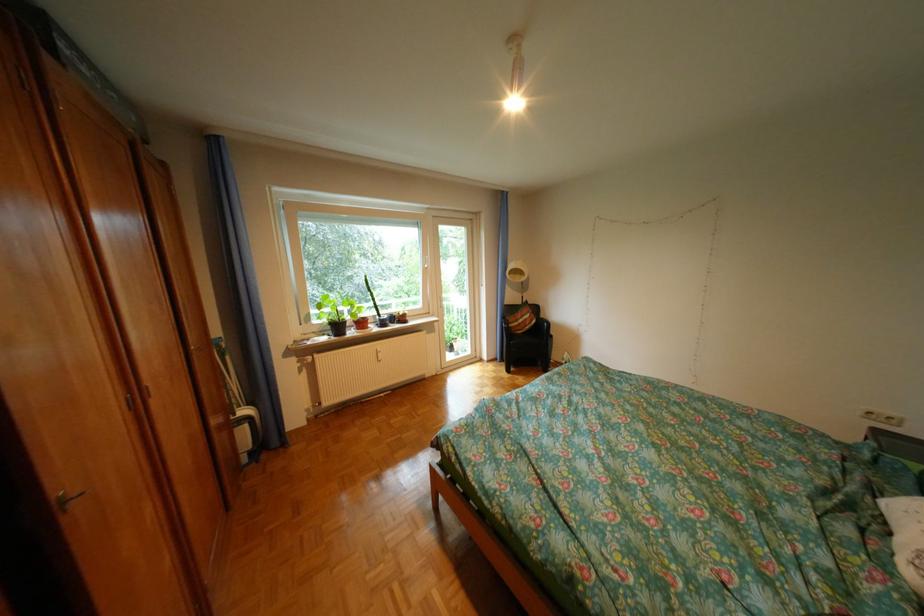
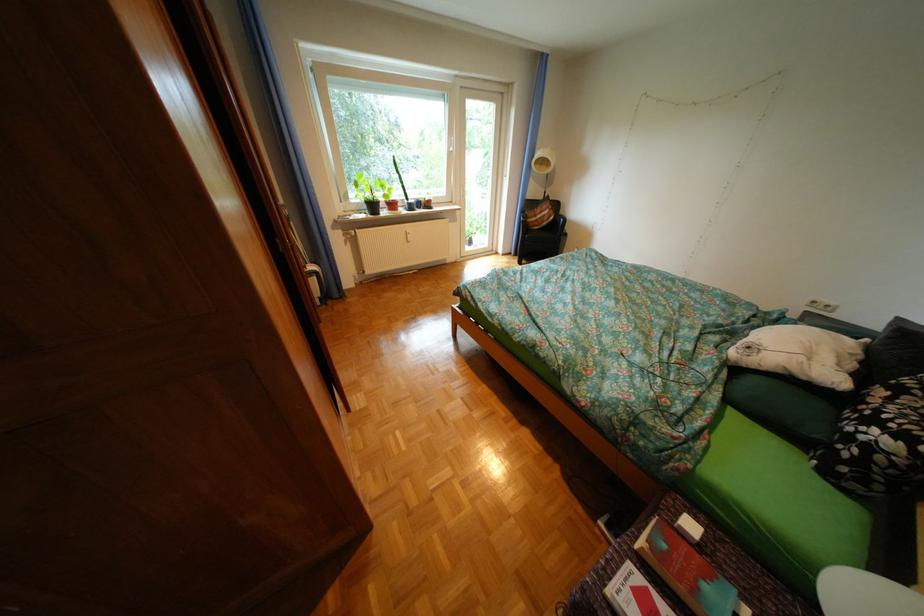
Locate, in the second image, the point that corresponds to the point at 353,328 in the first image.

(387, 207)